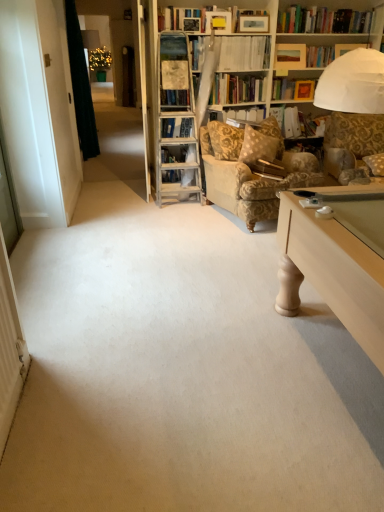
Question: Would you say white paper folder at upper center, the 1th book viewed from the back, is outside dark green fabric at left?

Choices:
 (A) no
 (B) yes

Answer: (B)

Question: From a real-world perspective, is white paper folder at upper center, the 3th book when ordered from front to back, beneath dark green fabric at left?

Choices:
 (A) no
 (B) yes

Answer: (B)

Question: Can you see white paper folder at upper center, the 1th book viewed from the back, touching dark green fabric at left?

Choices:
 (A) yes
 (B) no

Answer: (B)

Question: Does white paper folder at upper center, the 3th book when ordered from front to back, have a greater height compared to dark green fabric at left?

Choices:
 (A) yes
 (B) no

Answer: (B)

Question: Can you confirm if white paper folder at upper center, the 3th book when ordered from front to back, is smaller than dark green fabric at left?

Choices:
 (A) yes
 (B) no

Answer: (A)

Question: From a real-world perspective, is dark green fabric at left under hardcover book at center, which appears as the third book when viewed from the back?

Choices:
 (A) yes
 (B) no

Answer: (B)

Question: Considering the relative sizes of dark green fabric at left and hardcover book at center, placed as the 1th book when sorted from front to back, in the image provided, is dark green fabric at left bigger than hardcover book at center, placed as the 1th book when sorted from front to back,?

Choices:
 (A) yes
 (B) no

Answer: (A)

Question: Are dark green fabric at left and hardcover book at center, placed as the 1th book when sorted from front to back, beside each other?

Choices:
 (A) yes
 (B) no

Answer: (B)

Question: From the image's perspective, is dark green fabric at left located beneath hardcover book at center, placed as the 1th book when sorted from front to back?

Choices:
 (A) yes
 (B) no

Answer: (B)

Question: Does dark green fabric at left have a lesser width compared to hardcover book at center, which appears as the third book when viewed from the back?

Choices:
 (A) no
 (B) yes

Answer: (A)

Question: Is dark green fabric at left further to the viewer compared to hardcover book at center, placed as the 1th book when sorted from front to back?

Choices:
 (A) no
 (B) yes

Answer: (B)

Question: From a real-world perspective, is hardcover book at upper center, the 2th book from the back, physically above gold-patterned fabric armchair at center-right?

Choices:
 (A) no
 (B) yes

Answer: (B)